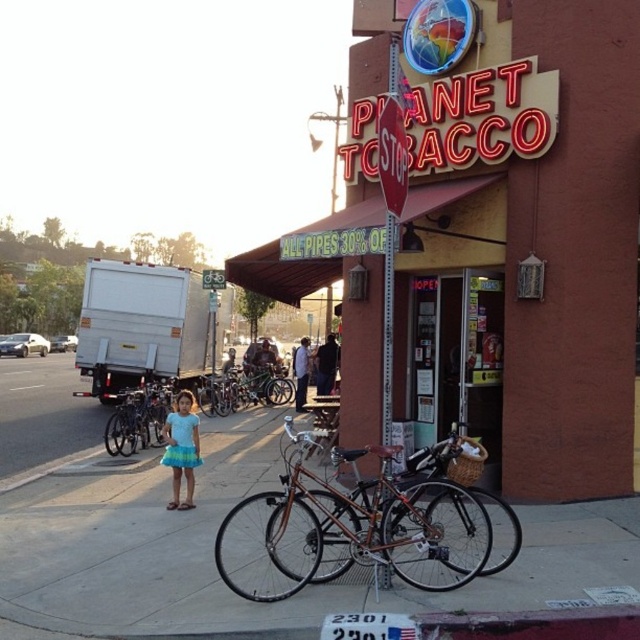
You are a delivery person who needs to park your bicycles between the stop sign and the entrance of Planet Tobacco. The distance between the stop sign and the entrance is 10 meters. Can both the shiny metallic bicycle at center and the shiny black bicycle at center fit in this space without overlapping?

The distance between the shiny metallic bicycle at center and the shiny black bicycle at center is 6.64 meters. Since the total space available between the stop sign and the entrance is 10 meters, both bicycles can fit without overlapping as 6.64 meters is less than 10 meters.

You are a delivery person trying to park your bicycle in a narrow alley between the tobacco shop and the stop sign. The alley is only 1.6 meters wide. You have two bicycles to park there, the shiny metallic bicycle at center and the shiny black bicycle at center. Can both bicycles fit side by side in the alley?

The shiny metallic bicycle at center is taller than the shiny black bicycle at center. However, the question is about width, not height. Since the alley is 1.6 meters wide, and we donot have information about the width of the bicycles, we cannot determine if both bicycles can fit side by side in the alley.

In the scene shown: You are a delivery person trying to park your shiny metallic bicycle at center and blue cotton dress at center near the entrance of Planet Tobacco. Since the entrance has limited space, can you park both side by side without overlapping?

The shiny metallic bicycle at center is wider than the blue cotton dress at center, so if you place them side by side, there might not be enough space as the bicycle takes up more width. You should check the total width required versus the available space.